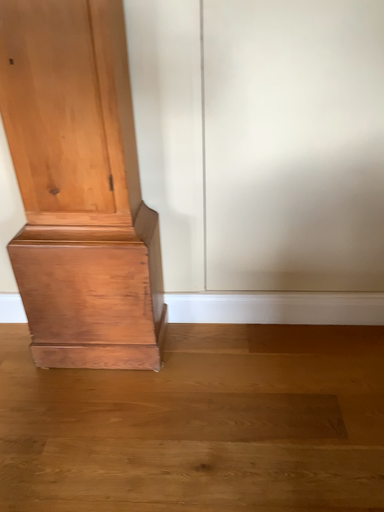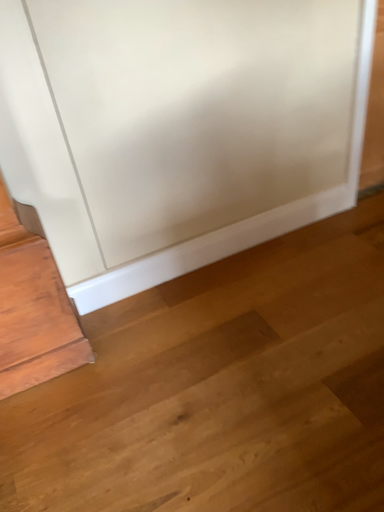
Question: Which way did the camera rotate in the video?

Choices:
 (A) rotated right
 (B) rotated left

Answer: (A)